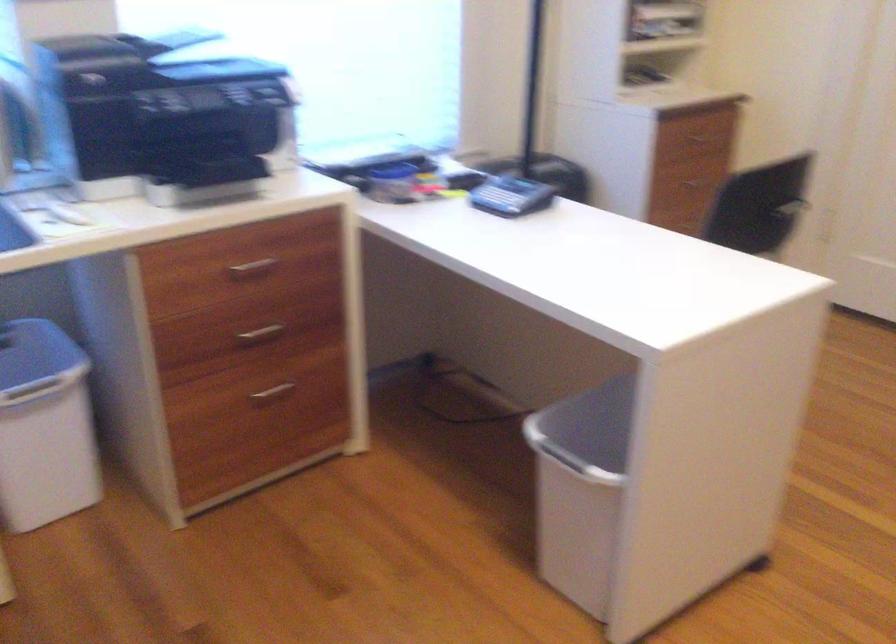
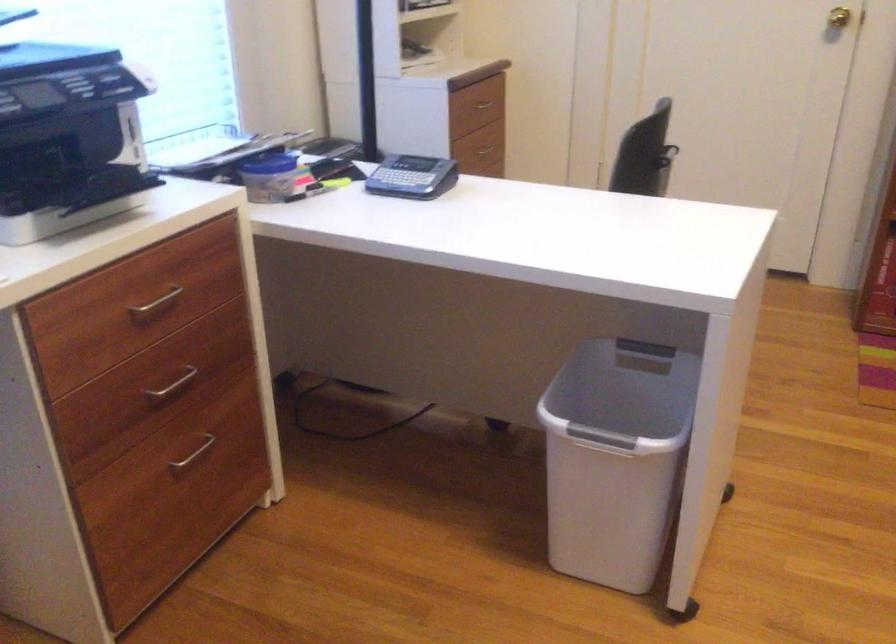
The point at (251,265) is marked in the first image. Where is the corresponding point in the second image?

(156, 303)